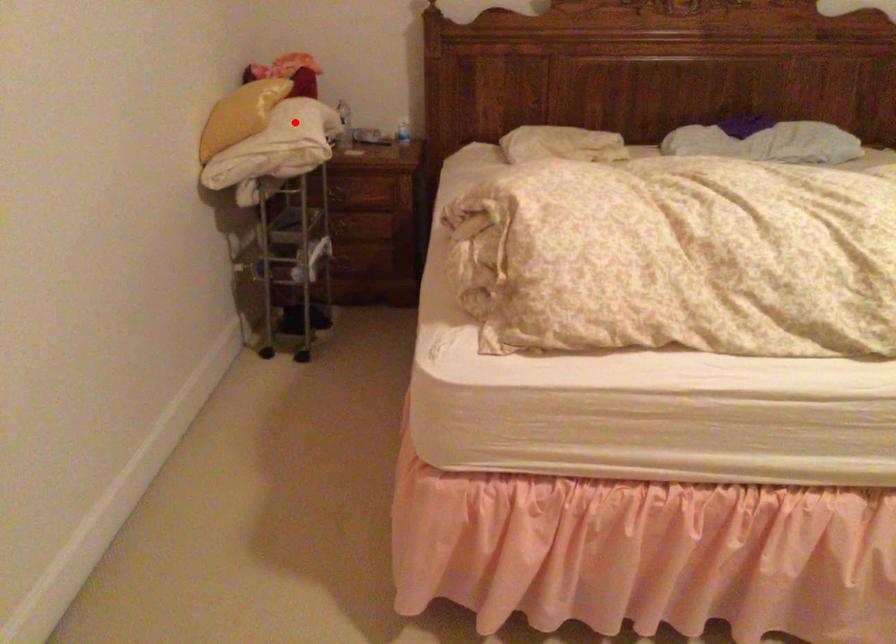
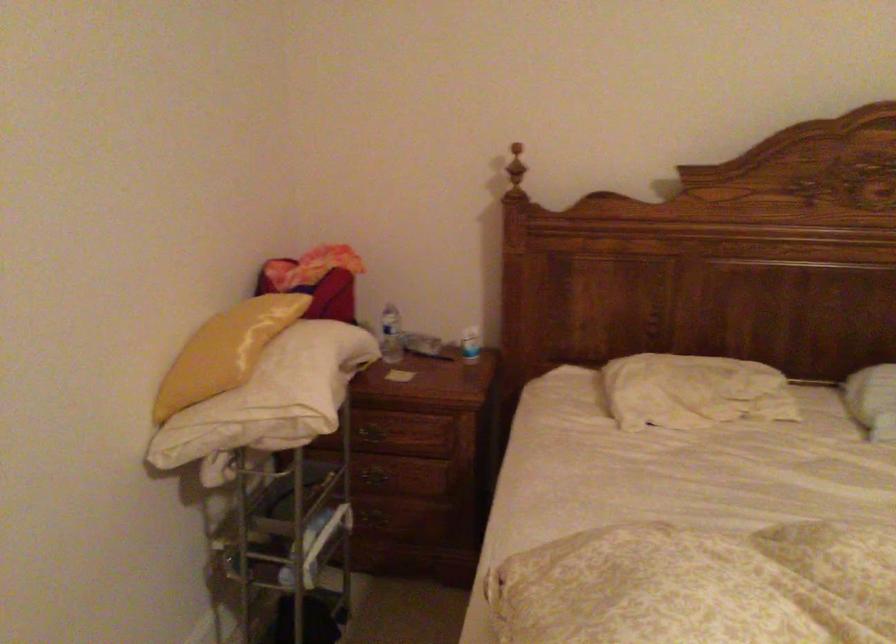
Question: I am providing you with two images of the same scene from different viewpoints. A red point is shown in image1. For the corresponding object point in image2, is it positioned nearer or farther from the camera?

Choices:
 (A) Nearer
 (B) Farther

Answer: (A)